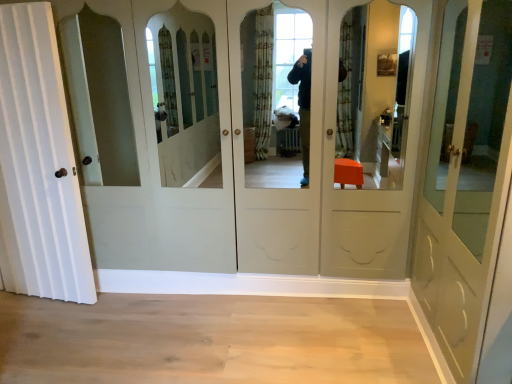
Question: Is matte white door at right, the 2th door positioned from the left, to the left or to the right of white wood door at left, placed as the 1th door when sorted from left to right, in the image?

Choices:
 (A) right
 (B) left

Answer: (A)

Question: From the image's perspective, is matte white door at right, which is counted as the first door, starting from the right, above or below white wood door at left, placed as the 1th door when sorted from left to right?

Choices:
 (A) below
 (B) above

Answer: (A)

Question: Which is correct: matte white door at right, the 2th door positioned from the left, is inside white wood door at left, placed as the 1th door when sorted from left to right, or outside of it?

Choices:
 (A) inside
 (B) outside

Answer: (B)

Question: From the image's perspective, is white wood door at left, the second door from the right, located above or below matte white door at right, the 2th door positioned from the left?

Choices:
 (A) below
 (B) above

Answer: (B)

Question: Do you think white wood door at left, the second door from the right, is within matte white door at right, which is counted as the first door, starting from the right, or outside of it?

Choices:
 (A) outside
 (B) inside

Answer: (A)

Question: Considering their positions, is white wood door at left, the second door from the right, located in front of or behind matte white door at right, which is counted as the first door, starting from the right?

Choices:
 (A) behind
 (B) front

Answer: (A)

Question: Is white wood door at left, placed as the 1th door when sorted from left to right, to the left or to the right of matte white door at right, the 2th door positioned from the left, in the image?

Choices:
 (A) left
 (B) right

Answer: (A)